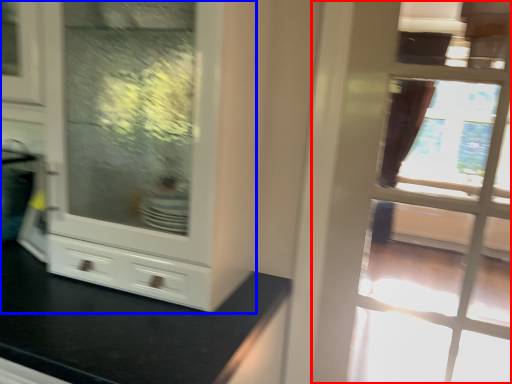
Question: Which of the following is the closest to the observer, door (highlighted by a red box) or cabinetry (highlighted by a blue box)?

Choices:
 (A) door
 (B) cabinetry

Answer: (B)